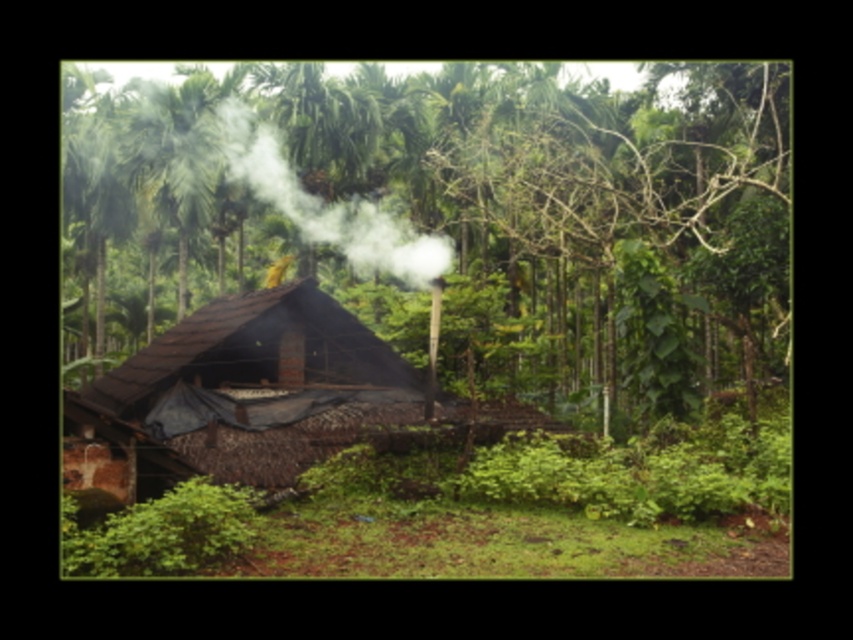
Between point (277, 465) and point (344, 220), which one is positioned behind?

Point (344, 220)

Is brown thatched hut at center wider than white smoke at center?

No.

Is point (334, 413) positioned after point (254, 180)?

No, it is in front of (254, 180).

Identify the location of brown thatched hut at center. This screenshot has width=853, height=640. (257, 385).

Does brown thatched roof at center appear over brown thatched hut at center?

Result: Indeed, brown thatched roof at center is positioned over brown thatched hut at center.

Which is in front, point (608, 264) or point (231, 372)?

Point (231, 372)

Locate an element on the screen. brown thatched roof at center is located at coordinates (456, 218).

Describe the element at coordinates (456, 218) in the screenshot. The image size is (853, 640). I see `brown thatched roof at center` at that location.

Can you confirm if brown thatched roof at center is positioned to the right of white smoke at center?

Correct, you'll find brown thatched roof at center to the right of white smoke at center.

You are a GUI agent. You are given a task and a screenshot of the screen. Output one action in this format:
    pyautogui.click(x=<x>, y=<y>)
    Task: Click on the brown thatched roof at center
    The image size is (853, 640).
    Given the screenshot: What is the action you would take?
    pyautogui.click(x=456, y=218)

The width and height of the screenshot is (853, 640). I want to click on brown thatched roof at center, so click(456, 218).